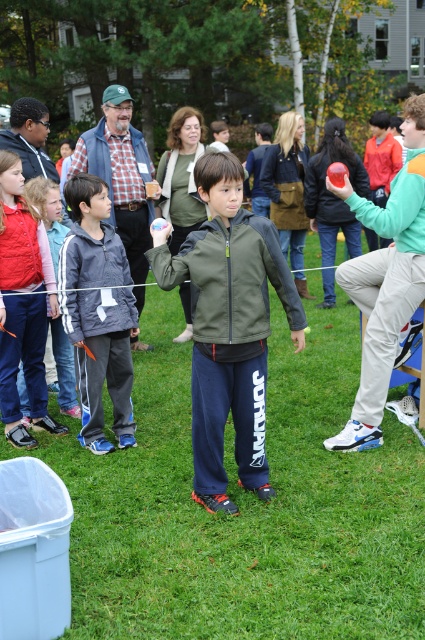
Question: Which of these objects is positioned closest to the green grass at center?

Choices:
 (A) matte green jacket at center
 (B) matte plastic ball at center

Answer: (B)

Question: Does green grass at center appear on the left side of matte plastic ball at center?

Choices:
 (A) no
 (B) yes

Answer: (B)

Question: Does matte plastic ball at center appear over matte green jacket at center?

Choices:
 (A) no
 (B) yes

Answer: (A)

Question: Observing the image, what is the correct spatial positioning of green grass at center in reference to gray fleece jacket at center?

Choices:
 (A) below
 (B) above

Answer: (A)

Question: Among these objects, which one is nearest to the camera?

Choices:
 (A) matte green jacket at center
 (B) green grass at center
 (C) gray fleece jacket at center
 (D) matte plastic ball at center

Answer: (B)

Question: Considering the real-world distances, which object is closest to the gray fleece jacket at center?

Choices:
 (A) matte plastic ball at center
 (B) matte green jacket at center

Answer: (B)